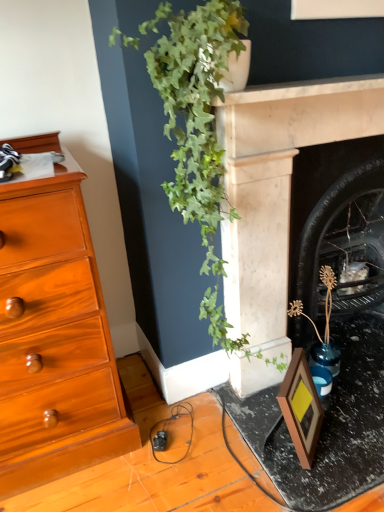
Question: Is matte black frame at lower right wider than black marble fireplace at center-right, marked as the 1th fireplace in a back-to-front arrangement?

Choices:
 (A) no
 (B) yes

Answer: (B)

Question: Can you confirm if matte black frame at lower right is thinner than black marble fireplace at center-right, which is the second fireplace in front-to-back order?

Choices:
 (A) yes
 (B) no

Answer: (B)

Question: Is the position of matte black frame at lower right less distant than that of black marble fireplace at center-right, marked as the 1th fireplace in a back-to-front arrangement?

Choices:
 (A) yes
 (B) no

Answer: (A)

Question: Can you confirm if matte black frame at lower right is shorter than black marble fireplace at center-right, marked as the 1th fireplace in a back-to-front arrangement?

Choices:
 (A) yes
 (B) no

Answer: (A)

Question: Is matte black frame at lower right at the left side of black marble fireplace at center-right, which is the second fireplace in front-to-back order?

Choices:
 (A) yes
 (B) no

Answer: (A)

Question: From the image's perspective, relative to marble fireplace at center-right, which is the 1th fireplace in front-to-back order, is wooden picture frame at lower right above or below?

Choices:
 (A) above
 (B) below

Answer: (B)

Question: Is wooden picture frame at lower right taller or shorter than marble fireplace at center-right, which is the 1th fireplace in front-to-back order?

Choices:
 (A) tall
 (B) short

Answer: (B)

Question: In the image, is wooden picture frame at lower right on the left side or the right side of marble fireplace at center-right, which is the 1th fireplace in front-to-back order?

Choices:
 (A) left
 (B) right

Answer: (A)

Question: Looking at the image, does wooden picture frame at lower right seem bigger or smaller compared to marble fireplace at center-right, the 2th fireplace viewed from the back?

Choices:
 (A) big
 (B) small

Answer: (B)

Question: From a real-world perspective, is black marble fireplace at center-right, marked as the 1th fireplace in a back-to-front arrangement, above or below matte black frame at lower right?

Choices:
 (A) above
 (B) below

Answer: (A)

Question: Looking at their shapes, would you say black marble fireplace at center-right, which is the second fireplace in front-to-back order, is wider or thinner than matte black frame at lower right?

Choices:
 (A) thin
 (B) wide

Answer: (A)

Question: Considering the positions of point (380, 157) and point (377, 354), is point (380, 157) closer or farther from the camera than point (377, 354)?

Choices:
 (A) closer
 (B) farther

Answer: (A)

Question: Considering the positions of black marble fireplace at center-right, marked as the 1th fireplace in a back-to-front arrangement, and matte black frame at lower right in the image, is black marble fireplace at center-right, marked as the 1th fireplace in a back-to-front arrangement, bigger or smaller than matte black frame at lower right?

Choices:
 (A) small
 (B) big

Answer: (B)

Question: From the image's perspective, is matte black frame at lower right above or below wooden picture frame at lower right?

Choices:
 (A) above
 (B) below

Answer: (B)

Question: Is matte black frame at lower right to the left or to the right of wooden picture frame at lower right in the image?

Choices:
 (A) left
 (B) right

Answer: (B)